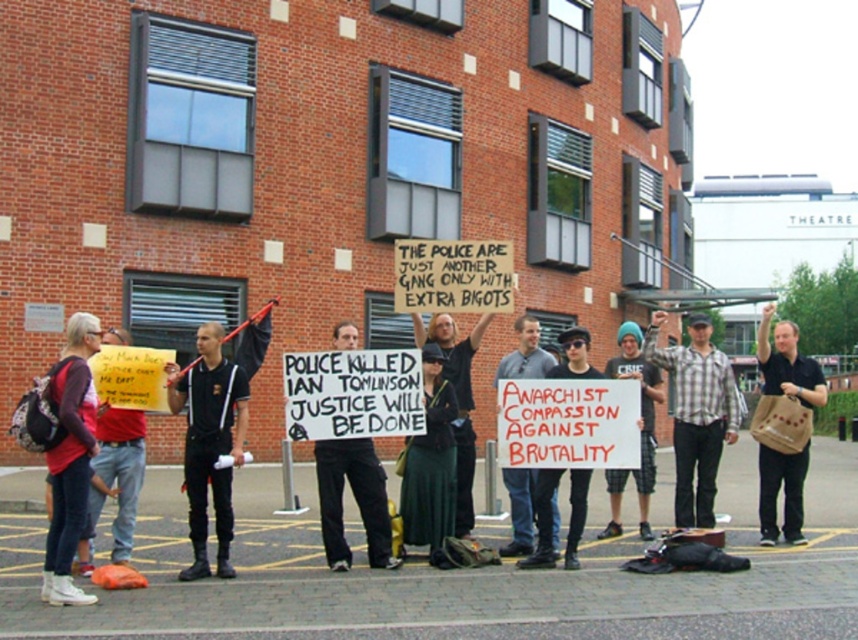
Question: Can you confirm if brown paper bag at center is bigger than black cotton pants at center?

Choices:
 (A) no
 (B) yes

Answer: (B)

Question: Considering the real-world distances, which object is farthest from the black matte shirt at center?

Choices:
 (A) white paper sign at center
 (B) red shirt at left
 (C) black cotton pants at center
 (D) blue knit cap at center

Answer: (D)

Question: Which object is the farthest from the black matte shirt at center?

Choices:
 (A) red shirt at left
 (B) brown paper bag at center

Answer: (B)

Question: Does blue knit cap at center lie behind white paper sign at center?

Choices:
 (A) yes
 (B) no

Answer: (A)

Question: Which object is positioned farthest from the red shirt at left?

Choices:
 (A) green fabric skirt at center
 (B) white paper sign at center

Answer: (B)

Question: Is black matte shirt at center positioned in front of black cotton pants at center?

Choices:
 (A) no
 (B) yes

Answer: (B)